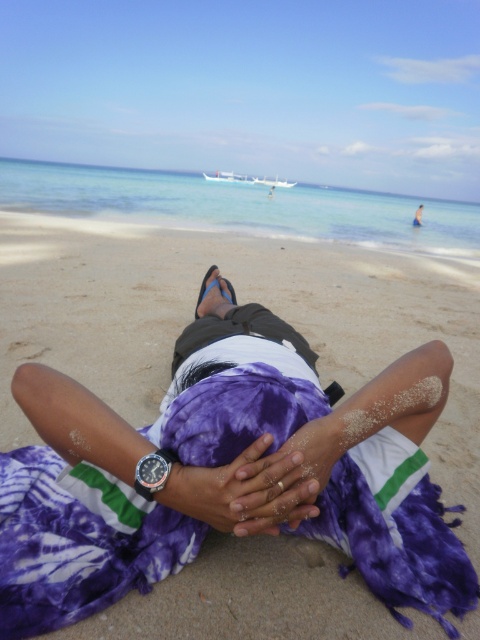
You are a photographer trying to capture the perfect shot of the beach scene. You notice two points marked on your camera screen at coordinates point (x=475, y=433) and point (x=50, y=461). Which point is closer to the camera lens?

Point (x=50, y=461) is closer to the camera lens because the description states that point (x=475, y=433) is further away from the camera than point (x=50, y=461).

You are a photographer trying to capture the perfect shot of the purple fabric at center and the purple fabric hands at center. Based on their positions, which object should you focus on first to ensure both are in frame?

The purple fabric at center should be focused on first since it is positioned under the purple fabric hands at center, ensuring both are in frame by starting with the lower object.